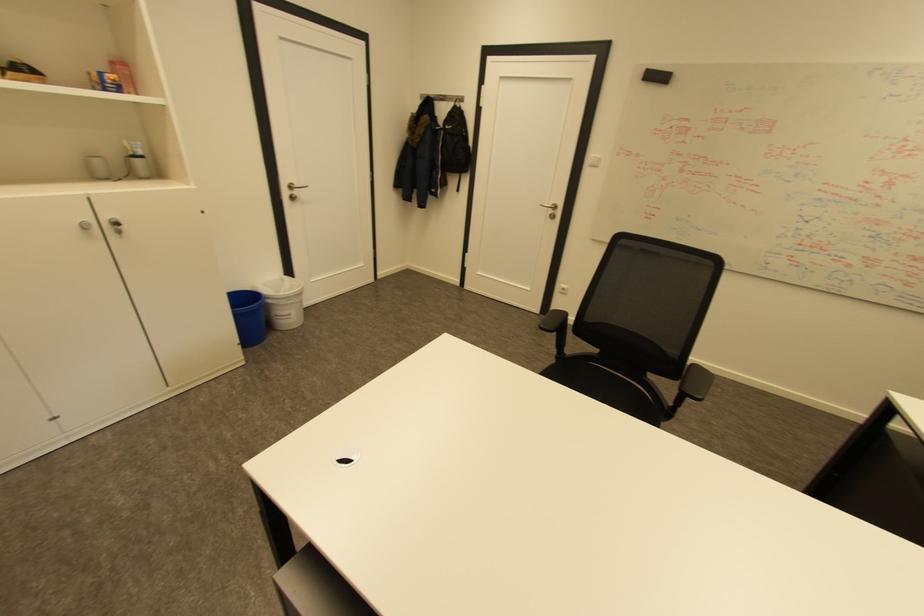
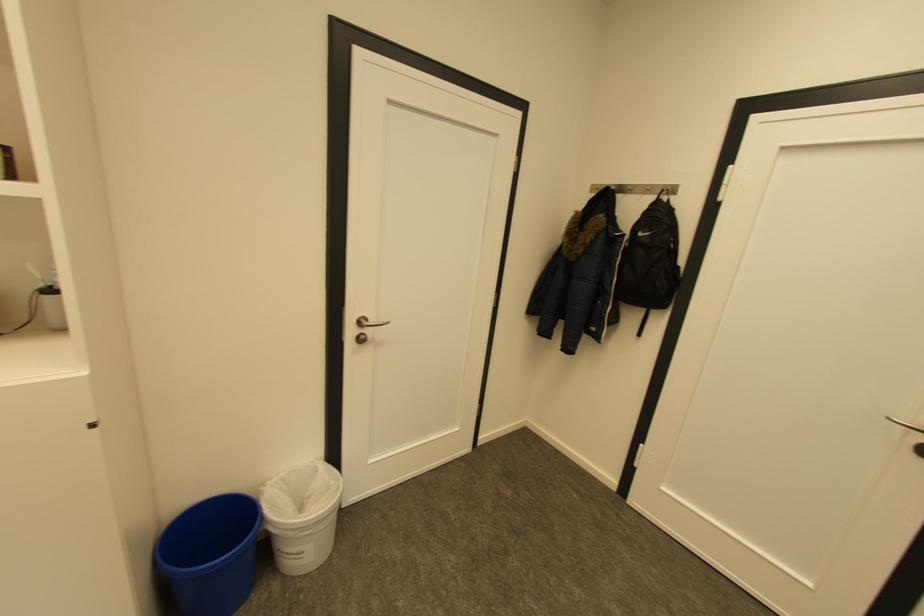
The point at [469,99] is marked in the first image. Where is the corresponding point in the second image?

(677, 190)